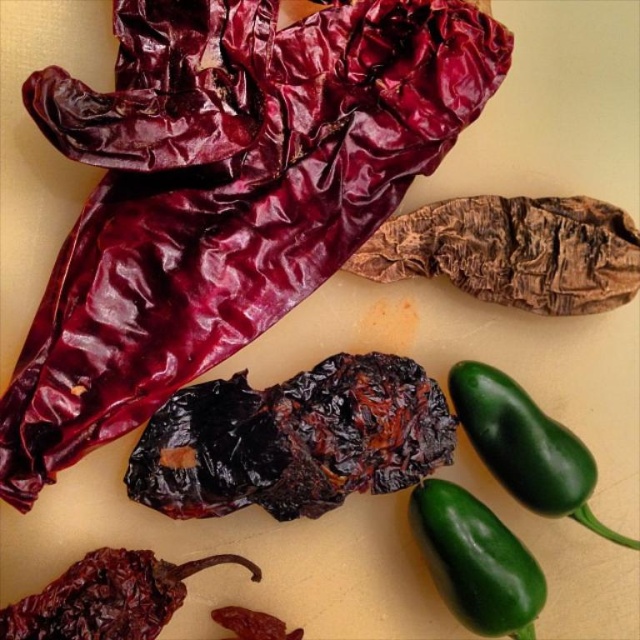
Can you confirm if green glossy jalapeño at lower right is positioned above dried red pepper at lower left?

Correct, green glossy jalapeño at lower right is located above dried red pepper at lower left.

Can you confirm if green glossy jalapeño at lower right is positioned to the right of dried red pepper at lower left?

Indeed, green glossy jalapeño at lower right is positioned on the right side of dried red pepper at lower left.

Measure the distance between green glossy jalapeño at lower right and camera.

The distance of green glossy jalapeño at lower right from camera is 1.21 meters.

Find the location of a particular element. green glossy jalapeño at lower right is located at coordinates (525, 445).

Can you confirm if brown leathery pepper at center is smaller than green glossy jalapeño at lower center?

No.

Does brown leathery pepper at center appear on the left side of green glossy jalapeño at lower center?

In fact, brown leathery pepper at center is to the right of green glossy jalapeño at lower center.

This screenshot has width=640, height=640. Find the location of `brown leathery pepper at center`. brown leathery pepper at center is located at coordinates (513, 252).

Can you confirm if brown leathery pepper at center is shorter than dried red pepper at lower left?

No.

Does brown leathery pepper at center appear on the right side of dried red pepper at lower left?

Correct, you'll find brown leathery pepper at center to the right of dried red pepper at lower left.

Where is `brown leathery pepper at center`? The width and height of the screenshot is (640, 640). brown leathery pepper at center is located at coordinates (513, 252).